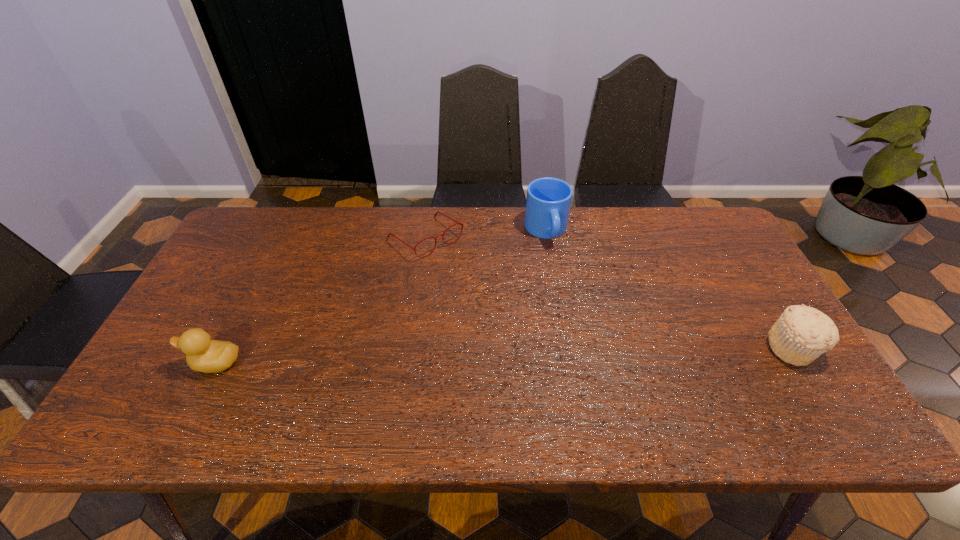
Locate an element on the screen. The height and width of the screenshot is (540, 960). duckling is located at coordinates (205, 355).

Find the location of a particular element. muffin is located at coordinates (802, 333).

Identify the location of spectacles. (457, 222).

You are a GUI agent. You are given a task and a screenshot of the screen. Output one action in this format:
    pyautogui.click(x=<x>, y=<y>)
    Task: Click on the shortest object
    
    Given the screenshot: What is the action you would take?
    pyautogui.click(x=457, y=222)

Locate an element on the screen. the second object from right to left is located at coordinates (548, 201).

You are a GUI agent. You are given a task and a screenshot of the screen. Output one action in this format:
    pyautogui.click(x=<x>, y=<y>)
    Task: Click on the vacant space located 0.070m on the face of the duckling
    
    Given the screenshot: What is the action you would take?
    pyautogui.click(x=160, y=363)

Find the location of a particular element. The width and height of the screenshot is (960, 540). free point located 0.060m on the face of the duckling is located at coordinates (164, 363).

Locate an element on the screen. vacant area situated 0.350m on the back of the muffin is located at coordinates click(x=727, y=241).

The image size is (960, 540). I want to click on free space located 0.130m on the face of the second object from left to right, so click(x=476, y=280).

Where is `vacant space located on the face of the second object from left to right`? This screenshot has width=960, height=540. vacant space located on the face of the second object from left to right is located at coordinates (476, 280).